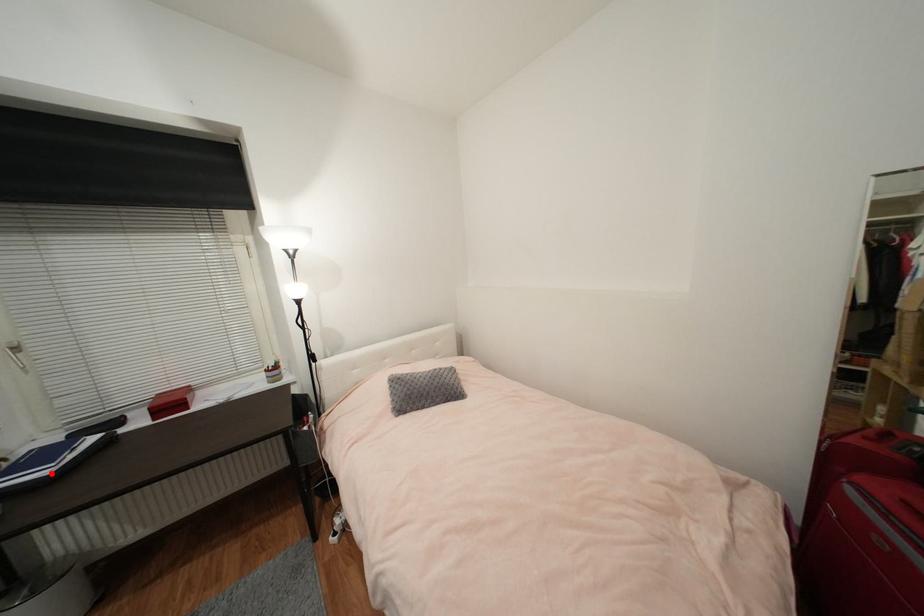
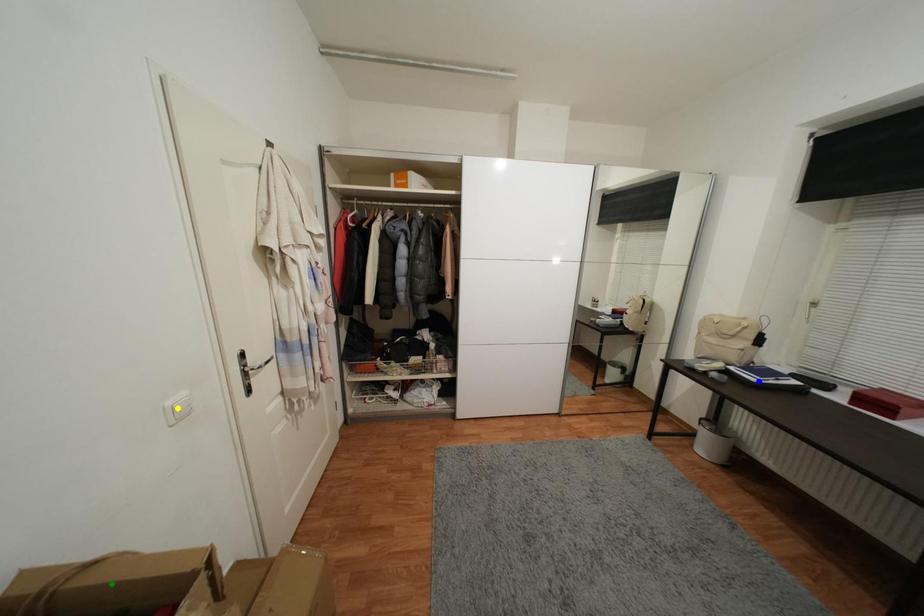
Question: I am providing you with two images of the same scene from different viewpoints. A red point is marked on the first image. You are given multiple points on the second image. Which mark in image 2 goes with the point in image 1?

Choices:
 (A) green point
 (B) blue point
 (C) yellow point

Answer: (B)